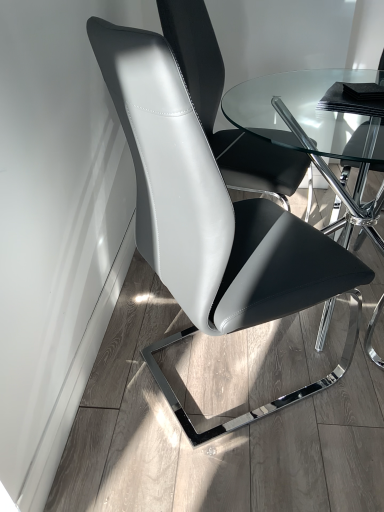
Question: Is the position of matte black chair at center, the 1th chair when ordered from front to back, more distant than that of white leather chair at center, which appears as the first chair when viewed from the back?

Choices:
 (A) no
 (B) yes

Answer: (A)

Question: Is white leather chair at center, the 2th chair viewed from the front, a part of matte black chair at center, positioned as the second chair in back-to-front order?

Choices:
 (A) no
 (B) yes

Answer: (A)

Question: Is matte black chair at center, positioned as the second chair in back-to-front order, positioned far away from white leather chair at center, the 2th chair viewed from the front?

Choices:
 (A) no
 (B) yes

Answer: (A)

Question: Considering the relative sizes of matte black chair at center, positioned as the second chair in back-to-front order, and white leather chair at center, the 2th chair viewed from the front, in the image provided, is matte black chair at center, positioned as the second chair in back-to-front order, bigger than white leather chair at center, the 2th chair viewed from the front,?

Choices:
 (A) no
 (B) yes

Answer: (B)

Question: Could you tell me if matte black chair at center, the 1th chair when ordered from front to back, is facing white leather chair at center, which appears as the first chair when viewed from the back?

Choices:
 (A) yes
 (B) no

Answer: (B)

Question: Is matte black chair at center, the 1th chair when ordered from front to back, wider or thinner than transparent glass table at center?

Choices:
 (A) wide
 (B) thin

Answer: (B)

Question: Do you think matte black chair at center, the 1th chair when ordered from front to back, is within transparent glass table at center, or outside of it?

Choices:
 (A) outside
 (B) inside

Answer: (A)

Question: In terms of height, does matte black chair at center, positioned as the second chair in back-to-front order, look taller or shorter compared to transparent glass table at center?

Choices:
 (A) short
 (B) tall

Answer: (B)

Question: Visually, is matte black chair at center, positioned as the second chair in back-to-front order, positioned to the left or to the right of transparent glass table at center?

Choices:
 (A) left
 (B) right

Answer: (A)

Question: Visually, is transparent glass table at center positioned to the left or to the right of white leather chair at center, which appears as the first chair when viewed from the back?

Choices:
 (A) left
 (B) right

Answer: (B)

Question: Which is correct: transparent glass table at center is inside white leather chair at center, which appears as the first chair when viewed from the back, or outside of it?

Choices:
 (A) outside
 (B) inside

Answer: (A)

Question: From the image's perspective, is transparent glass table at center above or below white leather chair at center, which appears as the first chair when viewed from the back?

Choices:
 (A) above
 (B) below

Answer: (B)

Question: Does point (372, 138) appear closer or farther from the camera than point (215, 91)?

Choices:
 (A) closer
 (B) farther

Answer: (B)

Question: In terms of size, does white leather chair at center, the 2th chair viewed from the front, appear bigger or smaller than matte black chair at center, positioned as the second chair in back-to-front order?

Choices:
 (A) small
 (B) big

Answer: (A)

Question: Visually, is white leather chair at center, the 2th chair viewed from the front, positioned to the left or to the right of matte black chair at center, the 1th chair when ordered from front to back?

Choices:
 (A) right
 (B) left

Answer: (A)